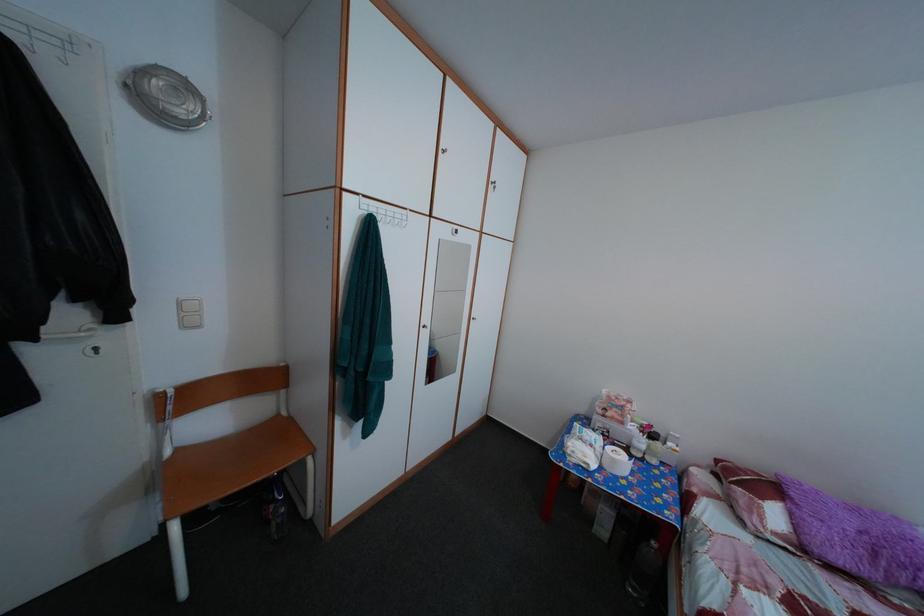
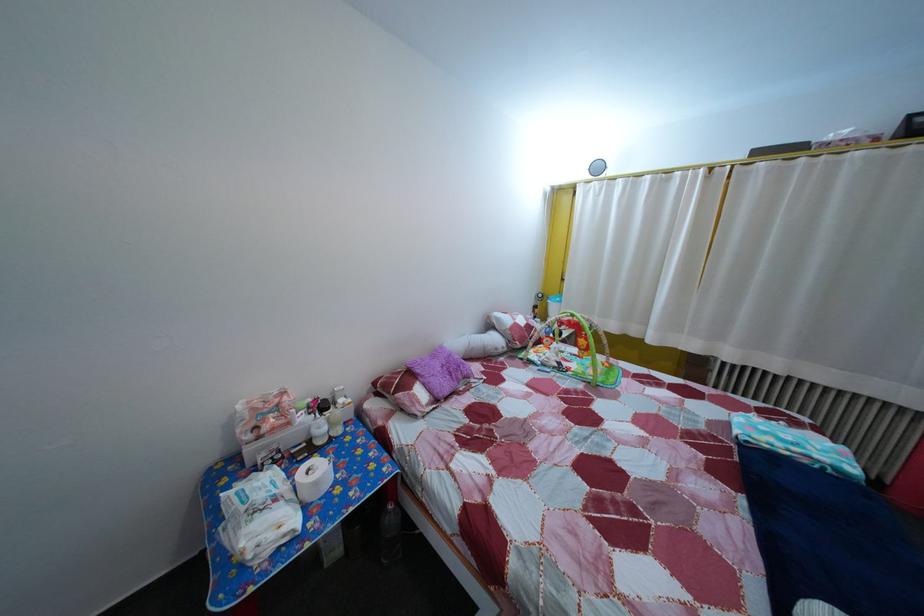
The point at (801, 522) is marked in the first image. Where is the corresponding point in the second image?

(433, 392)